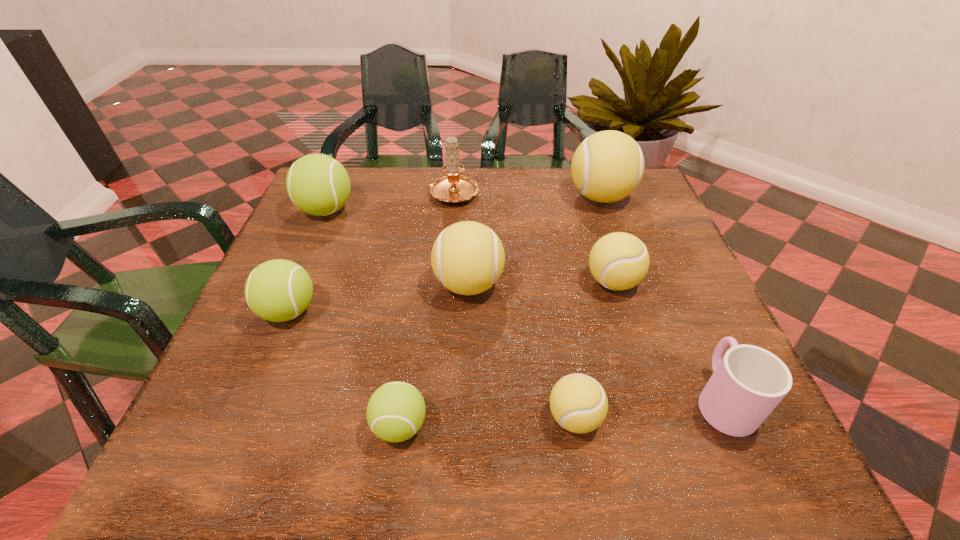
Where is `the tallest tennis ball`? the tallest tennis ball is located at coordinates (607, 166).

Image resolution: width=960 pixels, height=540 pixels. Identify the location of the biggest yellow tennis ball. (607, 166).

The width and height of the screenshot is (960, 540). What are the coordinates of `candle` in the screenshot? It's located at (453, 188).

Where is `the biggest green tennis ball`? the biggest green tennis ball is located at coordinates (317, 184).

At what (x,y) coordinates should I click in order to perform the action: click on the leftmost yellow tennis ball. Please return your answer as a coordinate pair (x, y). The image size is (960, 540). Looking at the image, I should click on (467, 257).

Image resolution: width=960 pixels, height=540 pixels. I want to click on the second farthest green tennis ball, so click(x=279, y=290).

At what (x,y) coordinates should I click in order to perform the action: click on the second smallest yellow tennis ball. Please return your answer as a coordinate pair (x, y). This screenshot has width=960, height=540. Looking at the image, I should click on (619, 261).

Locate an element on the screen. The height and width of the screenshot is (540, 960). cup is located at coordinates (749, 382).

The image size is (960, 540). I want to click on the nearest yellow tennis ball, so click(x=579, y=404).

The width and height of the screenshot is (960, 540). I want to click on the fourth object from right to left, so click(579, 404).